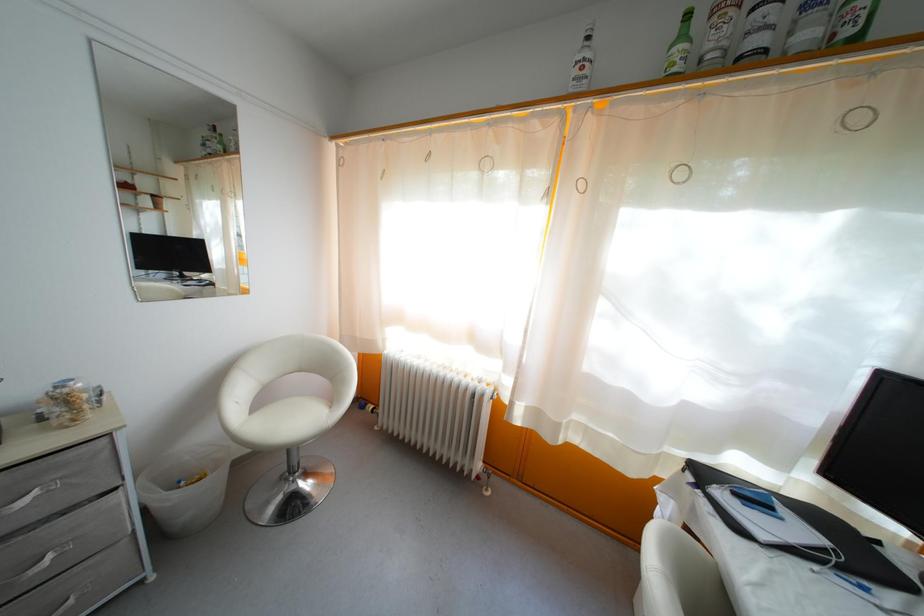
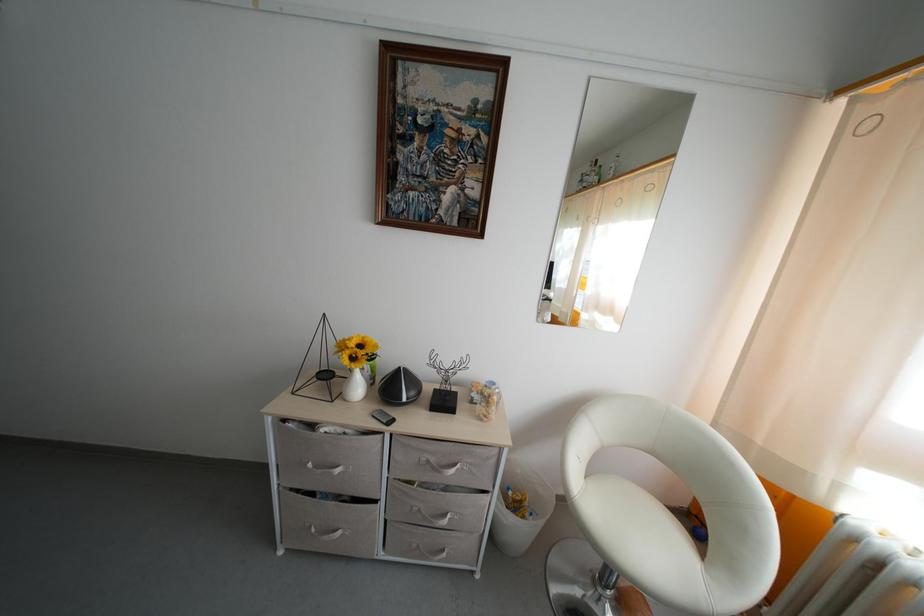
Locate, in the second image, the point that corresponds to [257,419] in the first image.

(591, 484)